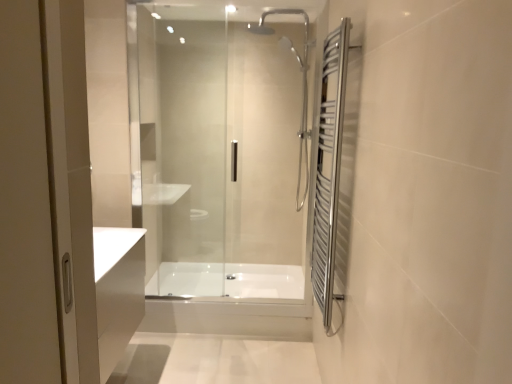
Question: From the image's perspective, is white glossy bathtub at center, the 1th bath viewed from the back, on polished chrome towel rack at right?

Choices:
 (A) yes
 (B) no

Answer: (B)

Question: Considering the relative sizes of white glossy bathtub at center, the 1th bath viewed from the back, and polished chrome towel rack at right in the image provided, is white glossy bathtub at center, the 1th bath viewed from the back, bigger than polished chrome towel rack at right?

Choices:
 (A) no
 (B) yes

Answer: (B)

Question: Considering the relative sizes of white glossy bathtub at center, the 1th bath viewed from the back, and polished chrome towel rack at right in the image provided, is white glossy bathtub at center, the 1th bath viewed from the back, taller than polished chrome towel rack at right?

Choices:
 (A) yes
 (B) no

Answer: (B)

Question: From a real-world perspective, is white glossy bathtub at center, which appears as the second bath when viewed from the front, below polished chrome towel rack at right?

Choices:
 (A) yes
 (B) no

Answer: (A)

Question: Is white glossy bathtub at center, which appears as the second bath when viewed from the front, facing away from polished chrome towel rack at right?

Choices:
 (A) yes
 (B) no

Answer: (B)

Question: Is white glossy bathtub at center, which appears as the second bath when viewed from the front, not inside polished chrome towel rack at right?

Choices:
 (A) yes
 (B) no

Answer: (A)

Question: Considering the relative sizes of polished chrome towel rack at right and transparent glass shower door at center in the image provided, is polished chrome towel rack at right shorter than transparent glass shower door at center?

Choices:
 (A) yes
 (B) no

Answer: (A)

Question: Does polished chrome towel rack at right have a greater height compared to transparent glass shower door at center?

Choices:
 (A) no
 (B) yes

Answer: (A)

Question: Would you say transparent glass shower door at center is part of polished chrome towel rack at right's contents?

Choices:
 (A) no
 (B) yes

Answer: (A)

Question: Is polished chrome towel rack at right at the right side of transparent glass shower door at center?

Choices:
 (A) yes
 (B) no

Answer: (A)

Question: Can you confirm if polished chrome towel rack at right is smaller than transparent glass shower door at center?

Choices:
 (A) no
 (B) yes

Answer: (B)

Question: Is polished chrome towel rack at right outside transparent glass shower door at center?

Choices:
 (A) no
 (B) yes

Answer: (B)

Question: Does polished chrome towel rack at right have a smaller size compared to white glossy bathtub at center, acting as the second bath starting from the back?

Choices:
 (A) yes
 (B) no

Answer: (B)